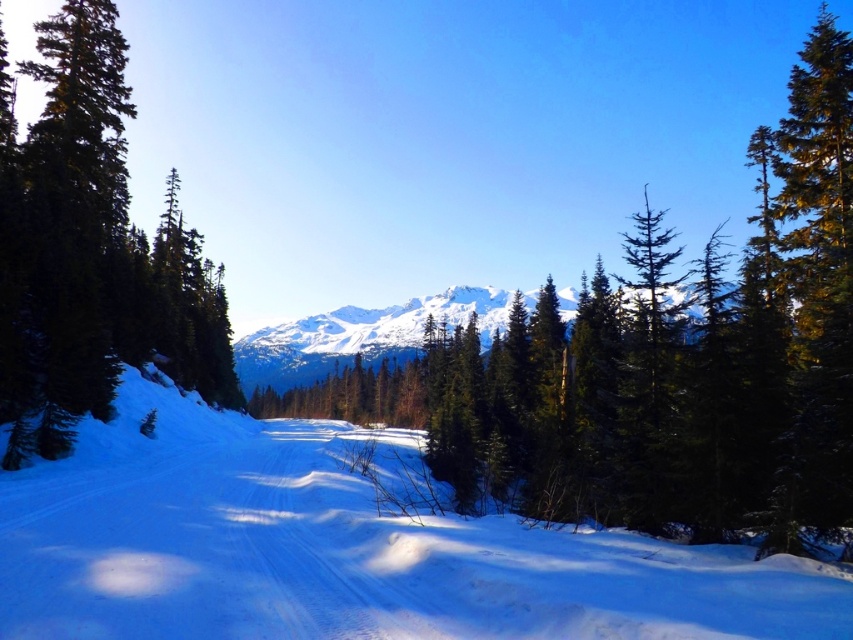
You are planning a ski trip and see the white snow ski slope at center and the green matte tree at left in the image. Which object is located to the right of the other?

The white snow ski slope at center is positioned on the right side of green matte tree at left.